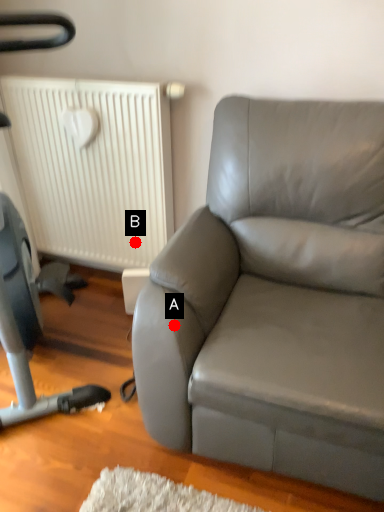
Question: Two points are circled on the image, labeled by A and B beside each circle. Which point is further to the camera?

Choices:
 (A) A is further
 (B) B is further

Answer: (B)